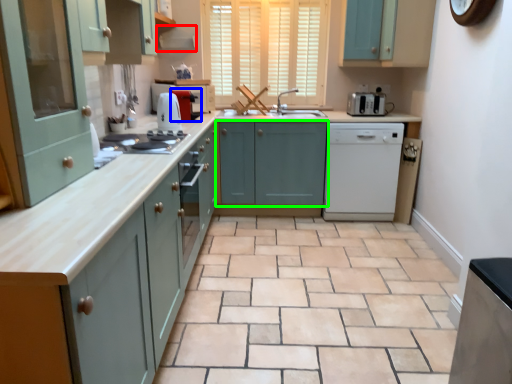
Question: Estimate the real-world distances between objects in this image. Which object is closer to exhaust hood (highlighted by a red box), coffee machine (highlighted by a blue box) or cabinetry (highlighted by a green box)?

Choices:
 (A) coffee machine
 (B) cabinetry

Answer: (A)